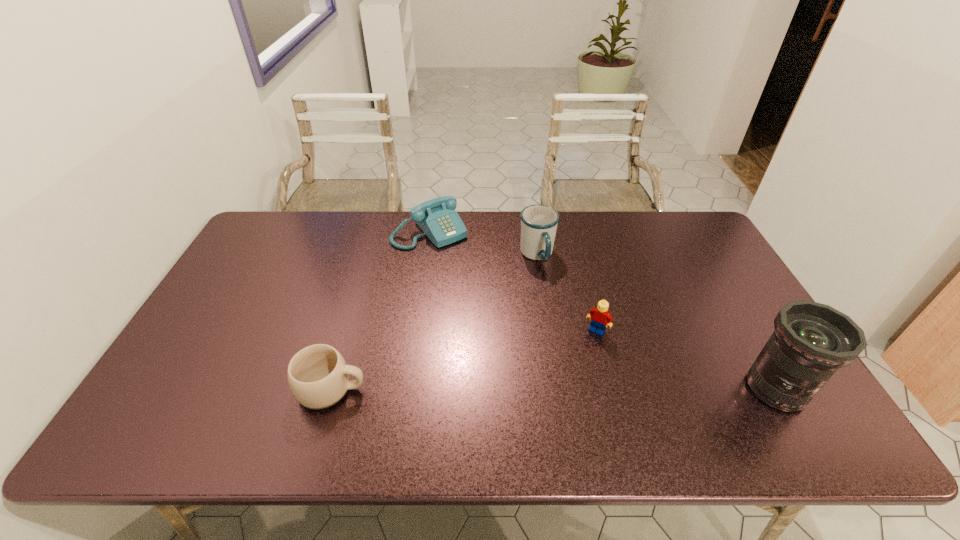
In the image, there is a desktop. Identify the location of free region at the far left corner. (247, 249).

This screenshot has height=540, width=960. Identify the location of free space at the far right corner. (649, 213).

Locate an element on the screen. free space between the telephone and the fourth object from left to right is located at coordinates (514, 281).

Where is `unoccupied area between the telephone and the Lego`? Image resolution: width=960 pixels, height=540 pixels. unoccupied area between the telephone and the Lego is located at coordinates (514, 281).

What are the coordinates of `free space between the telephone and the shorter mug` in the screenshot? It's located at (380, 310).

Where is `vacant region between the shorter mug and the farther mug`? The height and width of the screenshot is (540, 960). vacant region between the shorter mug and the farther mug is located at coordinates (434, 322).

Locate an element on the screen. Image resolution: width=960 pixels, height=540 pixels. vacant point located between the shorter mug and the telephoto lens is located at coordinates (554, 389).

You are a GUI agent. You are given a task and a screenshot of the screen. Output one action in this format:
    pyautogui.click(x=<x>, y=<y>)
    Task: Click on the free space between the Lego and the nearer mug
    This screenshot has width=960, height=540.
    Given the screenshot: What is the action you would take?
    pyautogui.click(x=464, y=360)

Locate an element on the screen. Image resolution: width=960 pixels, height=540 pixels. vacant point located between the right mug and the left mug is located at coordinates (434, 322).

Identify the location of free space between the third nearest object and the rightmost object. (686, 360).